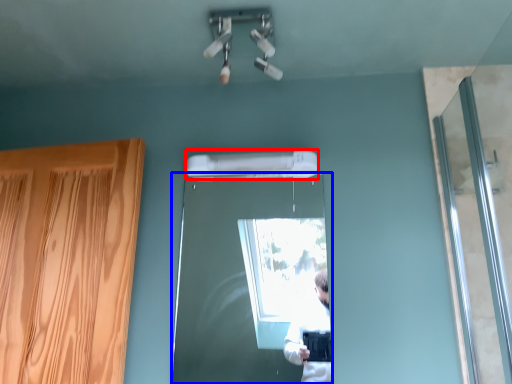
Question: Among these objects, which one is nearest to the camera, air conditioner (highlighted by a red box) or door (highlighted by a blue box)?

Choices:
 (A) air conditioner
 (B) door

Answer: (B)